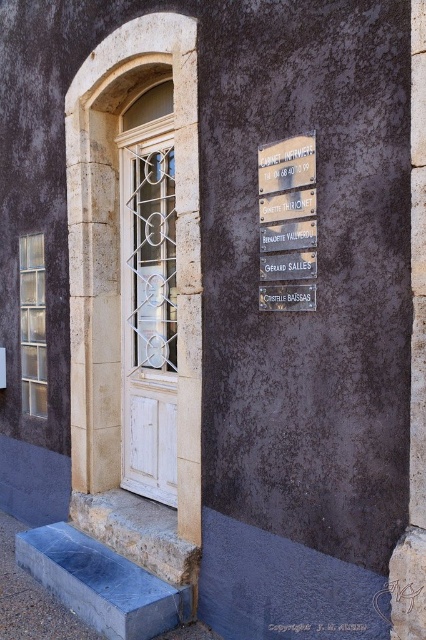
You are a delivery person trying to find the entrance to the building. You see the white wooden door at left and the rustic wood sign at upper right. According to the scene description, which object is located above the other?

The rustic wood sign at upper right is above the white wooden door at left because the white wooden door at left is positioned under it.

You are standing in front of the building and want to enter through the white wooden door at left. There is also a rustic wood sign at upper right that indicates directions. Which object is closer to you as you face the building?

The white wooden door at left is closer to you than the rustic wood sign at upper right because it is further to the viewer.

You are a delivery person trying to find the entrance to the building. You see the white wooden door at left and the rustic wood sign at upper right. According to the spatial arrangement, which object should you approach first to reach the entrance?

The white wooden door at left is to the left of the rustic wood sign at upper right, so you should approach the white wooden door at left first to reach the entrance.